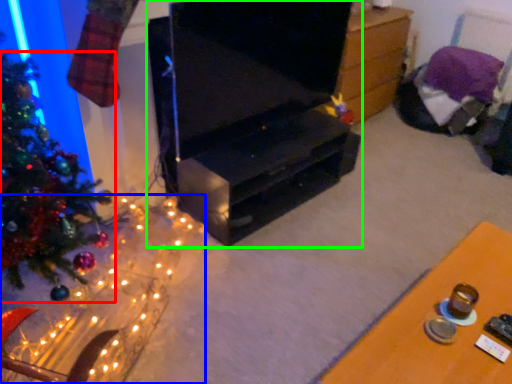
Question: Based on their relative distances, which object is farther from christmas tree (highlighted by a red box)? Choose from christmas decoration (highlighted by a blue box) and furniture (highlighted by a green box).

Choices:
 (A) christmas decoration
 (B) furniture

Answer: (B)